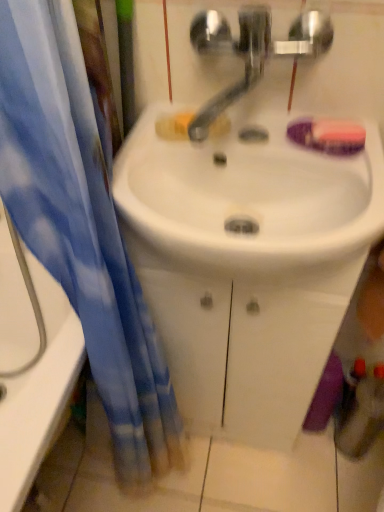
Question: From the image's perspective, is blue fabric curtain at left located above satin nickel faucet at center?

Choices:
 (A) yes
 (B) no

Answer: (B)

Question: Can you confirm if blue fabric curtain at left is wider than satin nickel faucet at center?

Choices:
 (A) yes
 (B) no

Answer: (A)

Question: Is blue fabric curtain at left touching satin nickel faucet at center?

Choices:
 (A) yes
 (B) no

Answer: (B)

Question: Is blue fabric curtain at left to the left of satin nickel faucet at center from the viewer's perspective?

Choices:
 (A) no
 (B) yes

Answer: (B)

Question: Is blue fabric curtain at left to the right of satin nickel faucet at center from the viewer's perspective?

Choices:
 (A) no
 (B) yes

Answer: (A)

Question: Considering their positions, is satin nickel faucet at center located in front of or behind purple matte soap at upper right?

Choices:
 (A) behind
 (B) front

Answer: (B)

Question: Is point (226, 39) positioned closer to the camera than point (312, 145)?

Choices:
 (A) farther
 (B) closer

Answer: (B)

Question: Considering the positions of satin nickel faucet at center and purple matte soap at upper right in the image, is satin nickel faucet at center wider or thinner than purple matte soap at upper right?

Choices:
 (A) wide
 (B) thin

Answer: (A)

Question: Is satin nickel faucet at center bigger or smaller than purple matte soap at upper right?

Choices:
 (A) small
 (B) big

Answer: (B)

Question: Considering their positions, is satin nickel faucet at center located in front of or behind blue fabric curtain at left?

Choices:
 (A) behind
 (B) front

Answer: (B)

Question: In terms of height, does satin nickel faucet at center look taller or shorter compared to blue fabric curtain at left?

Choices:
 (A) tall
 (B) short

Answer: (B)

Question: Considering the relative positions of satin nickel faucet at center and blue fabric curtain at left in the image provided, is satin nickel faucet at center to the left or to the right of blue fabric curtain at left?

Choices:
 (A) left
 (B) right

Answer: (B)

Question: Is point (251, 37) positioned closer to the camera than point (51, 83)?

Choices:
 (A) farther
 (B) closer

Answer: (A)

Question: Would you say white glossy bathtub at left is inside or outside blue fabric curtain at left?

Choices:
 (A) outside
 (B) inside

Answer: (A)

Question: Visually, is white glossy bathtub at left positioned to the left or to the right of blue fabric curtain at left?

Choices:
 (A) right
 (B) left

Answer: (B)